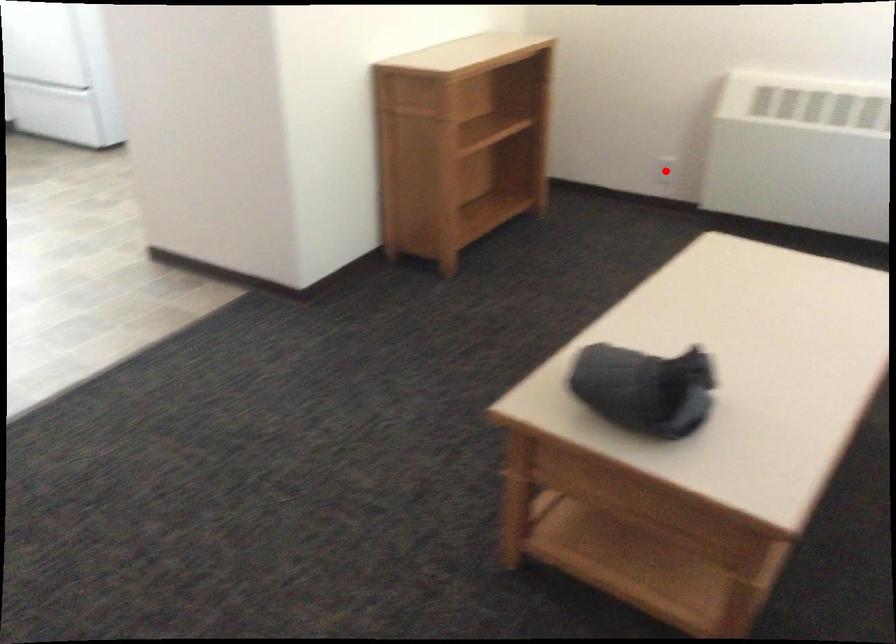
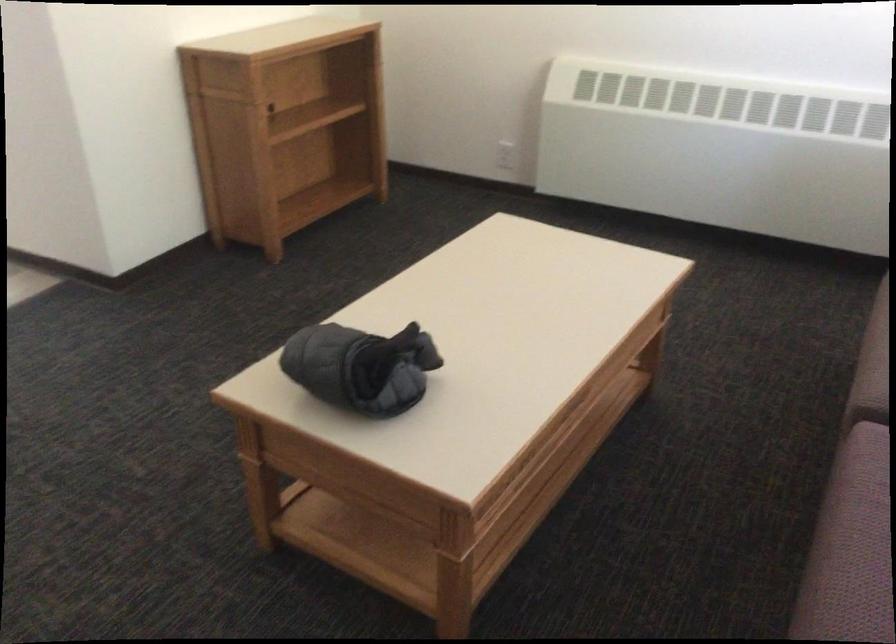
Locate, in the second image, the point that corresponds to the highlighted location in the first image.

(505, 155)